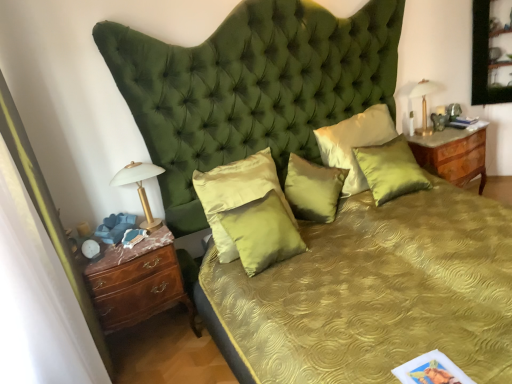
Question: Does satin gold pillow at center, arranged as the 5th pillow when viewed from the right, have a larger size compared to burlwood/marble nightstand at right?

Choices:
 (A) no
 (B) yes

Answer: (A)

Question: Is satin gold pillow at center, the first pillow from the left, at the right side of burlwood/marble nightstand at right?

Choices:
 (A) yes
 (B) no

Answer: (B)

Question: Is satin gold pillow at center, arranged as the 5th pillow when viewed from the right, far from burlwood/marble nightstand at right?

Choices:
 (A) yes
 (B) no

Answer: (A)

Question: From the image's perspective, would you say satin gold pillow at center, the first pillow from the left, is shown under burlwood/marble nightstand at right?

Choices:
 (A) yes
 (B) no

Answer: (A)

Question: Considering the relative positions of satin gold pillow at center, the first pillow from the left, and burlwood/marble nightstand at right in the image provided, is satin gold pillow at center, the first pillow from the left, to the left of burlwood/marble nightstand at right from the viewer's perspective?

Choices:
 (A) yes
 (B) no

Answer: (A)

Question: Visually, is burlwood/marble nightstand at right positioned to the left or to the right of gold metallic lamp at upper right, marked as the first bedside lamp in a back-to-front arrangement?

Choices:
 (A) right
 (B) left

Answer: (A)

Question: Is burlwood/marble nightstand at right taller or shorter than gold metallic lamp at upper right, acting as the 2th bedside lamp starting from the bottom?

Choices:
 (A) short
 (B) tall

Answer: (B)

Question: Is point (433, 150) closer or farther from the camera than point (420, 135)?

Choices:
 (A) closer
 (B) farther

Answer: (A)

Question: Considering their positions, is burlwood/marble nightstand at right located in front of or behind gold metallic lamp at upper right, marked as the first bedside lamp in a back-to-front arrangement?

Choices:
 (A) behind
 (B) front

Answer: (B)

Question: From the image's perspective, is brown wood chest of drawers at left above or below gold metallic lamp at upper right, marked as the first bedside lamp in a back-to-front arrangement?

Choices:
 (A) below
 (B) above

Answer: (A)

Question: Considering their positions, is brown wood chest of drawers at left located in front of or behind gold metallic lamp at upper right, the 1th bedside lamp from the top?

Choices:
 (A) front
 (B) behind

Answer: (A)

Question: Is point (113, 246) positioned closer to the camera than point (424, 79)?

Choices:
 (A) farther
 (B) closer

Answer: (B)

Question: Considering the relative positions of brown wood chest of drawers at left and gold metallic lamp at upper right, marked as the first bedside lamp in a back-to-front arrangement, in the image provided, is brown wood chest of drawers at left to the left or to the right of gold metallic lamp at upper right, marked as the first bedside lamp in a back-to-front arrangement,?

Choices:
 (A) right
 (B) left

Answer: (B)

Question: From the image's perspective, is burlwood/marble nightstand at right above or below satin gold pillow at center, the first pillow from the left?

Choices:
 (A) above
 (B) below

Answer: (A)

Question: Is burlwood/marble nightstand at right wider or thinner than satin gold pillow at center, arranged as the 5th pillow when viewed from the right?

Choices:
 (A) thin
 (B) wide

Answer: (B)